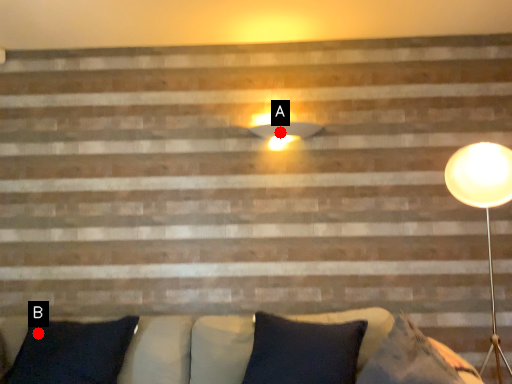
Question: Two points are circled on the image, labeled by A and B beside each circle. Which point is farther to the camera?

Choices:
 (A) A is further
 (B) B is further

Answer: (A)